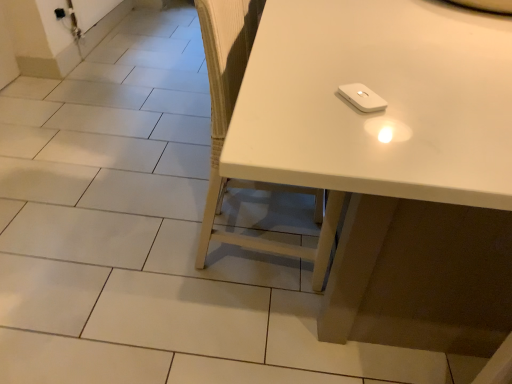
This screenshot has width=512, height=384. Identify the location of vacant area that lies in front of white matte wii controller at upper center. (376, 148).